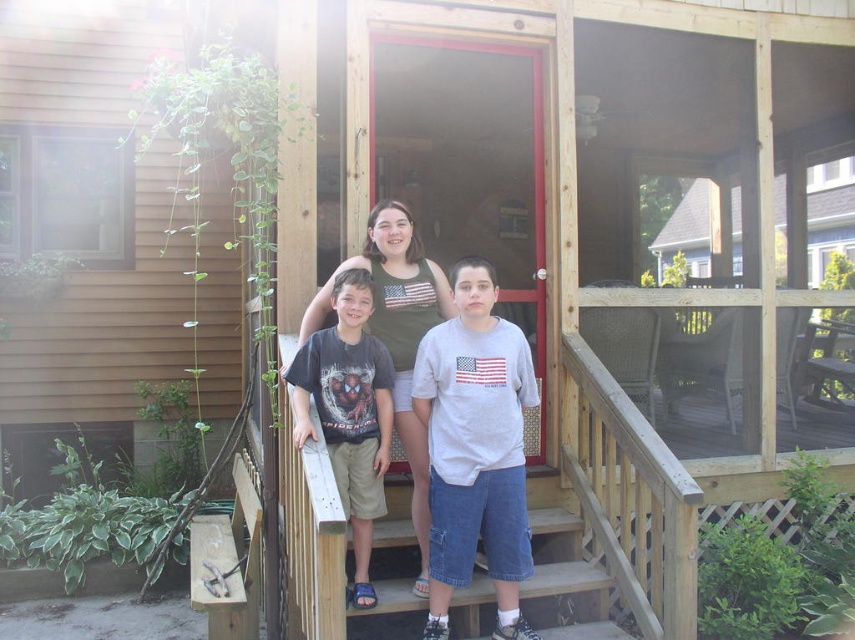
Between gray cotton t-shirt at center and dark gray t-shirt at center, which one is positioned lower?

gray cotton t-shirt at center is lower down.

Can you confirm if gray cotton t-shirt at center is positioned to the right of dark gray t-shirt at center?

Correct, you'll find gray cotton t-shirt at center to the right of dark gray t-shirt at center.

The width and height of the screenshot is (855, 640). I want to click on gray cotton t-shirt at center, so click(x=475, y=449).

Consider the image. Measure the distance between dark gray t-shirt at center and camera.

dark gray t-shirt at center is 2.83 meters away from camera.

Can you confirm if dark gray t-shirt at center is positioned to the left of american flag t-shirt at center?

Correct, you'll find dark gray t-shirt at center to the left of american flag t-shirt at center.

Where is `dark gray t-shirt at center`? Image resolution: width=855 pixels, height=640 pixels. dark gray t-shirt at center is located at coordinates (348, 412).

Find the location of `gray cotton t-shirt at center`. gray cotton t-shirt at center is located at coordinates (475, 449).

What do you see at coordinates (475, 449) in the screenshot? I see `gray cotton t-shirt at center` at bounding box center [475, 449].

Is point (450, 502) positioned behind point (305, 337)?

No, (450, 502) is closer to viewer.

Find the location of a particular element. The image size is (855, 640). gray cotton t-shirt at center is located at coordinates (475, 449).